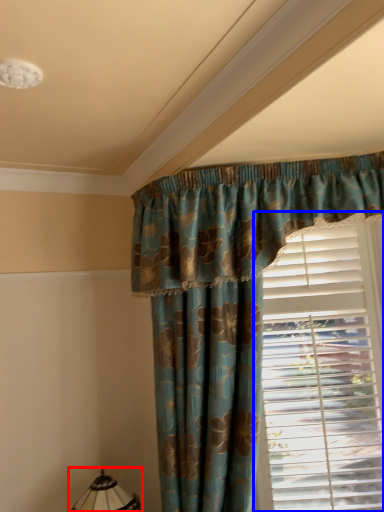
Question: Among these objects, which one is nearest to the camera, table lamp (highlighted by a red box) or window blind (highlighted by a blue box)?

Choices:
 (A) table lamp
 (B) window blind

Answer: (A)